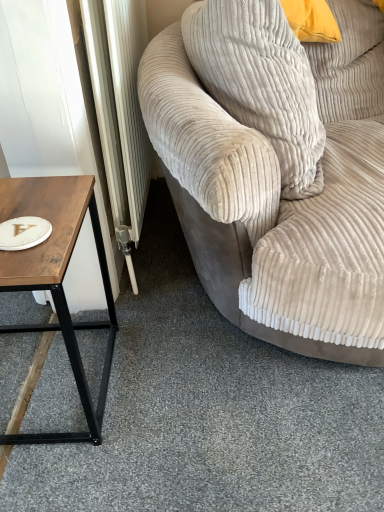
Where is `vacant area on top of wooden table at left (from a real-world perspective)`? This screenshot has width=384, height=512. vacant area on top of wooden table at left (from a real-world perspective) is located at coordinates (26, 211).